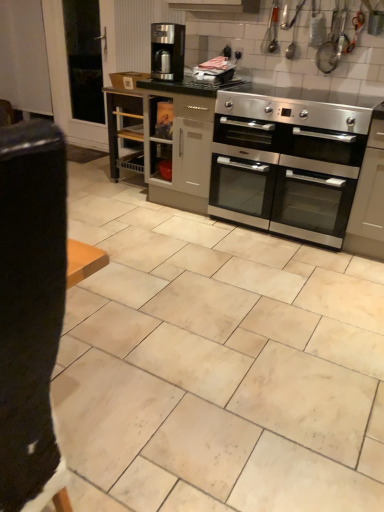
At what (x,y) coordinates should I click in order to perform the action: click on vacant space situated on the left part of stainless steel oven at center. Please return your answer as a coordinate pair (x, y). The height and width of the screenshot is (512, 384). Looking at the image, I should click on (179, 233).